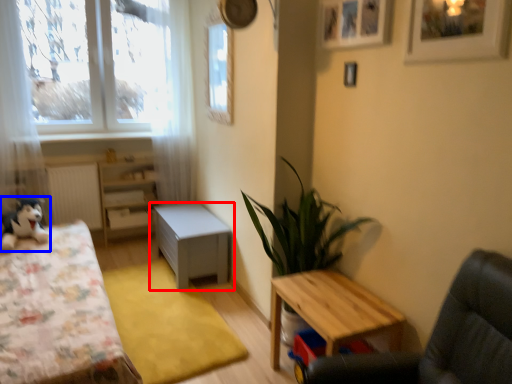
Question: Which object is closer to the camera taking this photo, table (highlighted by a red box) or toy (highlighted by a blue box)?

Choices:
 (A) table
 (B) toy

Answer: (B)